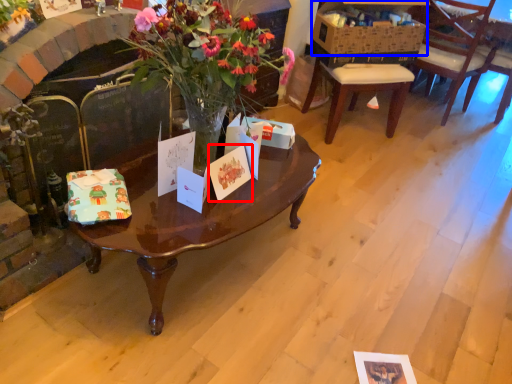
Question: Which of the following is the farthest to the observer, gift card (highlighted by a red box) or box (highlighted by a blue box)?

Choices:
 (A) gift card
 (B) box

Answer: (B)